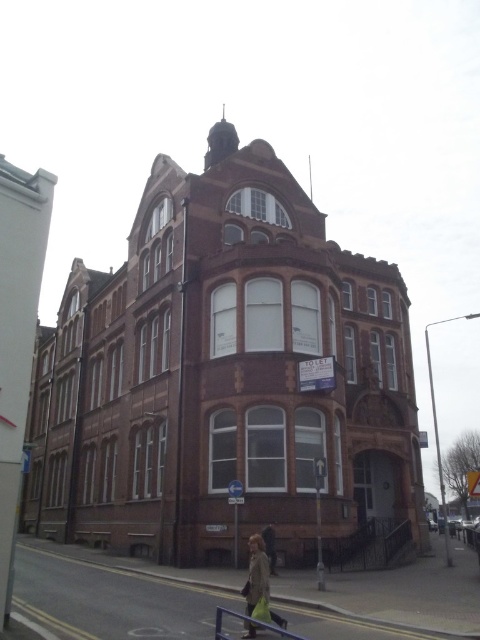
Based on the photo, you are standing in front of the Victorian building and see the light brown leather coat at lower center and the metallic gray railing at lower center. Which object is closer to you?

The light brown leather coat at lower center is closer to you because it is further to the viewer than the metallic gray railing at lower center.